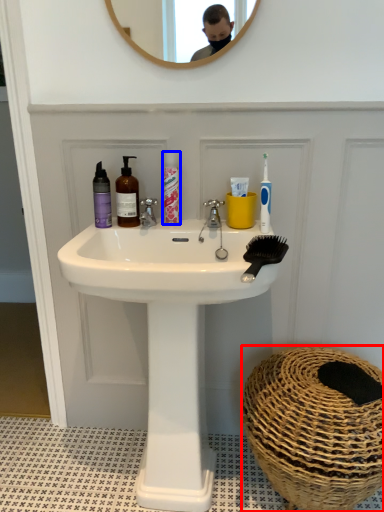
Question: Among these objects, which one is nearest to the camera, basket (highlighted by a red box) or mouthwash (highlighted by a blue box)?

Choices:
 (A) basket
 (B) mouthwash

Answer: (A)